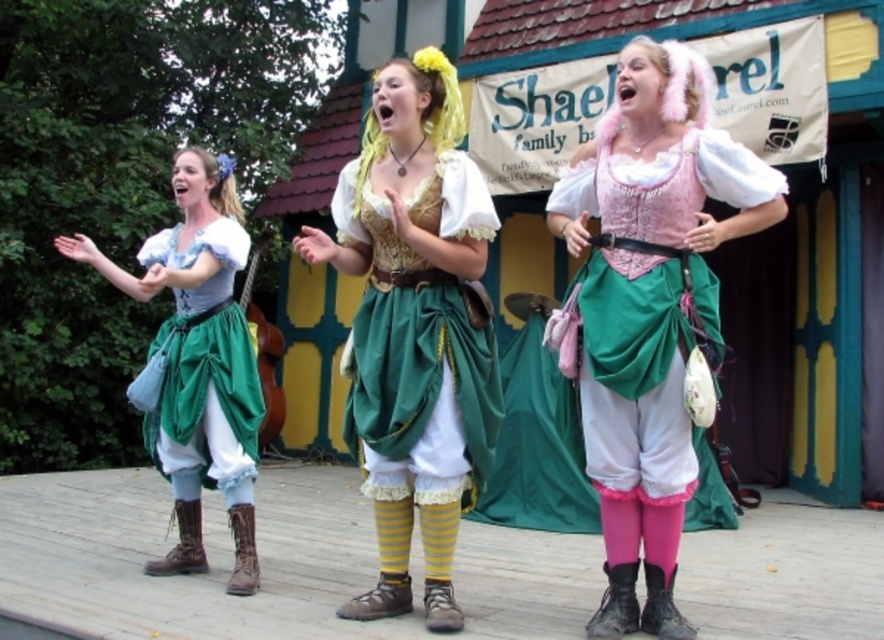
Between matte blue fabric dress at left and pink fluffy wig at center, which one has less height?

With less height is pink fluffy wig at center.

Between matte blue fabric dress at left and pink fluffy wig at center, which one is positioned lower?

Positioned lower is matte blue fabric dress at left.

Does point (165, 468) lie in front of point (653, 61)?

That is False.

Find the location of a particular element. matte blue fabric dress at left is located at coordinates (196, 349).

Does green satin dress at center have a larger size compared to yellowhair/fabricwig at center?

Yes, green satin dress at center is bigger than yellowhair/fabricwig at center.

Based on the photo, which is above, green satin dress at center or yellowhair/fabricwig at center?

Positioned higher is yellowhair/fabricwig at center.

Locate an element on the screen. green satin dress at center is located at coordinates (415, 326).

Can you confirm if matte green skirt at center is positioned above yellowhair/fabricwig at center?

No.

Is point (184, 356) farther from viewer compared to point (444, 100)?

Yes, it is.

Does point (242, 346) come closer to viewer compared to point (431, 115)?

No, it is behind (431, 115).

You are a GUI agent. You are given a task and a screenshot of the screen. Output one action in this format:
    pyautogui.click(x=<x>, y=<y>)
    Task: Click on the matte green skirt at center
    Image resolution: width=884 pixels, height=640 pixels.
    Given the screenshot: What is the action you would take?
    pyautogui.click(x=204, y=365)